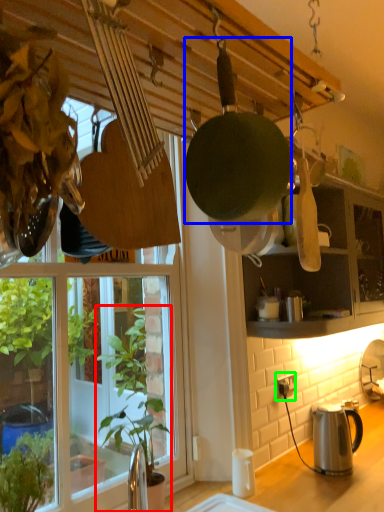
Question: Which object is positioned closest to houseplant (highlighted by a red box)? Select from frying pan (highlighted by a blue box) and power outlet (highlighted by a green box).

Choices:
 (A) frying pan
 (B) power outlet

Answer: (B)